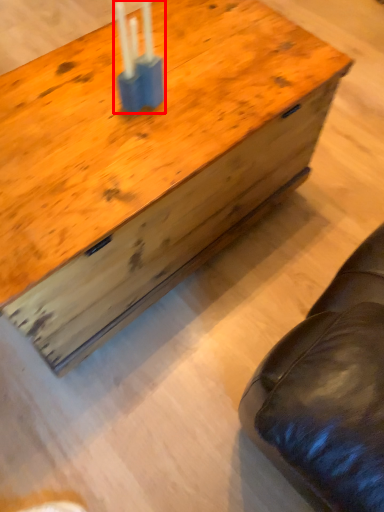
Question: Considering the relative positions of candle holder (annotated by the red box) and table in the image provided, where is candle holder (annotated by the red box) located with respect to the staircase?

Choices:
 (A) right
 (B) left

Answer: (A)